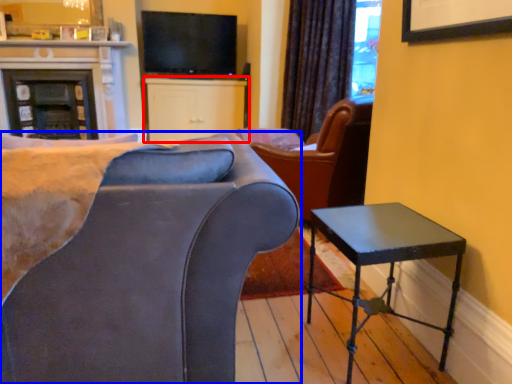
Question: Which point is closer to the camera, cabinetry (highlighted by a red box) or chair (highlighted by a blue box)?

Choices:
 (A) cabinetry
 (B) chair

Answer: (B)